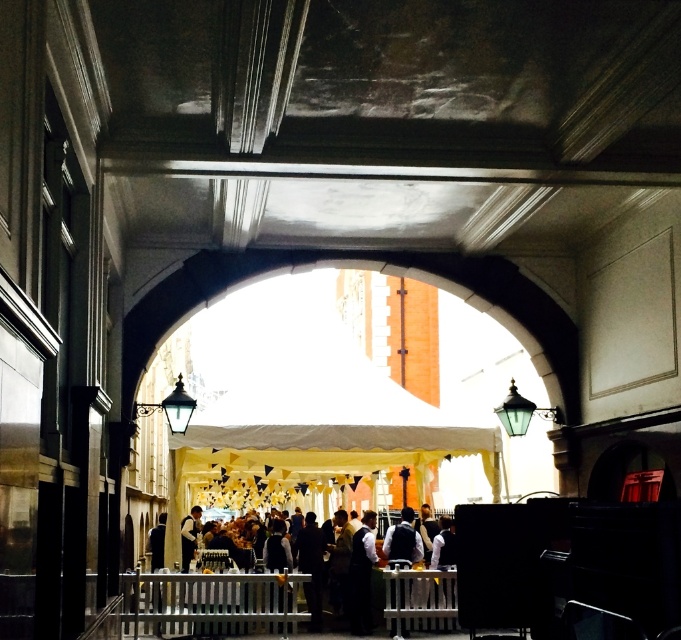
Question: Does dark gray suit at center appear over white shirt at center?

Choices:
 (A) no
 (B) yes

Answer: (B)

Question: Is dark gray suit at center behind white shirt at center?

Choices:
 (A) yes
 (B) no

Answer: (B)

Question: Which point is farther to the camera?

Choices:
 (A) white shirt at center
 (B) dark gray suit at center

Answer: (A)

Question: Can you confirm if dark gray suit at center is positioned below white shirt at center?

Choices:
 (A) yes
 (B) no

Answer: (B)

Question: Which point appears farthest from the camera in this image?

Choices:
 (A) (183, 541)
 (B) (434, 618)

Answer: (A)